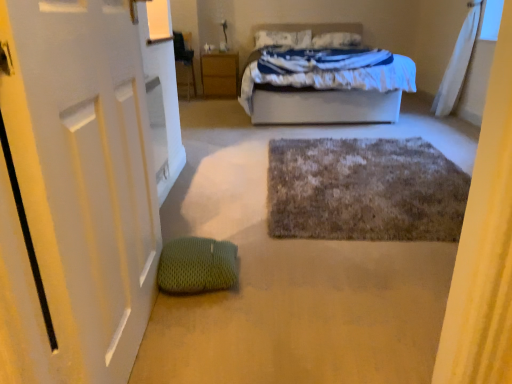
Question: Should I look upward or downward to see white soft pillow at upper center, which is counted as the first pillow, starting from the left?

Choices:
 (A) up
 (B) down

Answer: (A)

Question: Is wooden nightstand at center in front of white sheer curtain at upper right?

Choices:
 (A) yes
 (B) no

Answer: (B)

Question: Can you see wooden nightstand at center touching white sheer curtain at upper right?

Choices:
 (A) no
 (B) yes

Answer: (A)

Question: From a real-world perspective, is wooden nightstand at center positioned under white sheer curtain at upper right based on gravity?

Choices:
 (A) no
 (B) yes

Answer: (B)

Question: Does wooden nightstand at center have a larger size compared to white sheer curtain at upper right?

Choices:
 (A) yes
 (B) no

Answer: (B)

Question: From the image's perspective, is wooden nightstand at center under white sheer curtain at upper right?

Choices:
 (A) yes
 (B) no

Answer: (B)

Question: Would you say wooden nightstand at center is a long distance from white sheer curtain at upper right?

Choices:
 (A) no
 (B) yes

Answer: (B)

Question: Would you say white soft pillow at upper center, the second pillow in the left-to-right sequence, is outside green textured bean bag at lower left?

Choices:
 (A) no
 (B) yes

Answer: (B)

Question: Is white soft pillow at upper center, the second pillow in the left-to-right sequence, thinner than green textured bean bag at lower left?

Choices:
 (A) yes
 (B) no

Answer: (B)

Question: Is green textured bean bag at lower left located within white soft pillow at upper center, the second pillow in the left-to-right sequence?

Choices:
 (A) yes
 (B) no

Answer: (B)

Question: From the image's perspective, would you say white soft pillow at upper center, the 1th pillow from the right, is shown under green textured bean bag at lower left?

Choices:
 (A) no
 (B) yes

Answer: (A)

Question: Does white soft pillow at upper center, the second pillow in the left-to-right sequence, come in front of green textured bean bag at lower left?

Choices:
 (A) no
 (B) yes

Answer: (A)

Question: Is white soft pillow at upper center, the 1th pillow from the right, to the left of green textured bean bag at lower left from the viewer's perspective?

Choices:
 (A) yes
 (B) no

Answer: (B)

Question: Is white soft bed at center facing towards white soft pillow at upper center, which is counted as the first pillow, starting from the left?

Choices:
 (A) yes
 (B) no

Answer: (B)